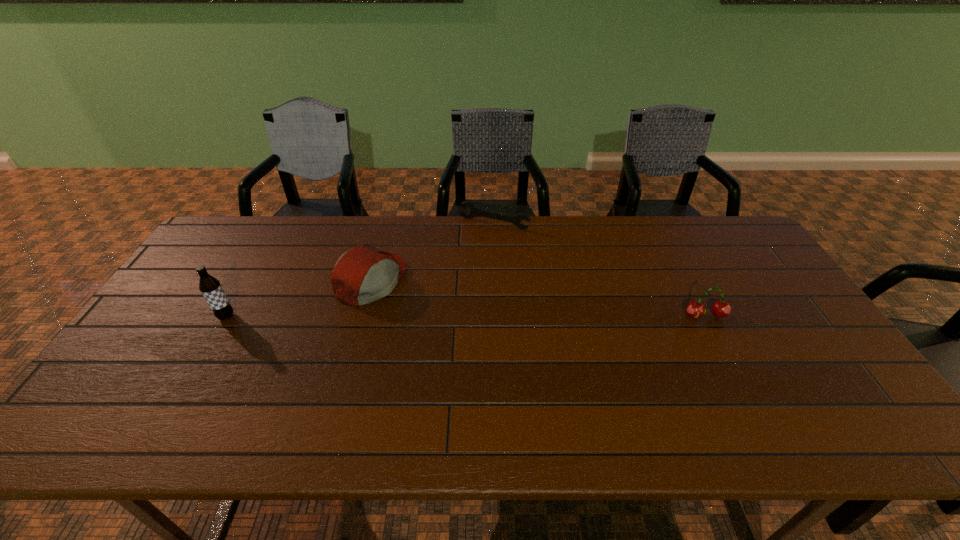
Where is `vacant space at the right edge of the desktop`? This screenshot has height=540, width=960. vacant space at the right edge of the desktop is located at coordinates (831, 372).

At what (x,y) coordinates should I click in order to perform the action: click on vacant point at the far left corner. Please return your answer as a coordinate pair (x, y). Image resolution: width=960 pixels, height=540 pixels. Looking at the image, I should click on (252, 234).

Find the location of a particular element. The width and height of the screenshot is (960, 540). free location at the near left corner of the desktop is located at coordinates (136, 403).

Identify the location of vacant area at the far right corner of the desktop. (724, 240).

The height and width of the screenshot is (540, 960). I want to click on empty space that is in between the tallest object and the second object from left to right, so click(x=299, y=299).

Where is `free area in between the second object from left to right and the rightmost object`? This screenshot has width=960, height=540. free area in between the second object from left to right and the rightmost object is located at coordinates (539, 298).

This screenshot has height=540, width=960. I want to click on vacant point located between the cap and the leftmost object, so click(299, 299).

At what (x,y) coordinates should I click in order to perform the action: click on empty location between the shortest object and the third object from right to left. Please return your answer as a coordinate pair (x, y). The width and height of the screenshot is (960, 540). Looking at the image, I should click on (433, 252).

Find the location of `empty location between the third nearest object and the wrench`. empty location between the third nearest object and the wrench is located at coordinates (433, 252).

Identify the location of unoccupied position between the rightmost object and the shortest object. (600, 269).